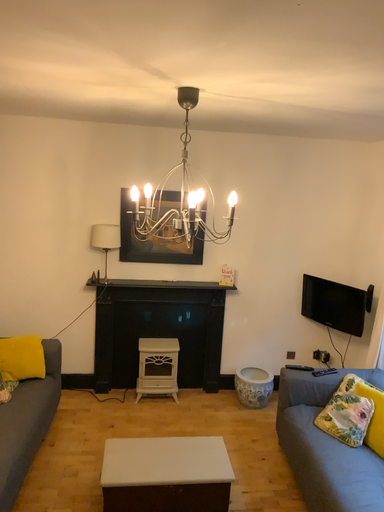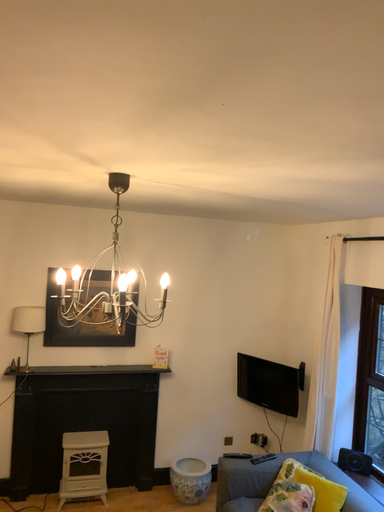
Question: Which way did the camera rotate in the video?

Choices:
 (A) rotated right
 (B) rotated left

Answer: (A)